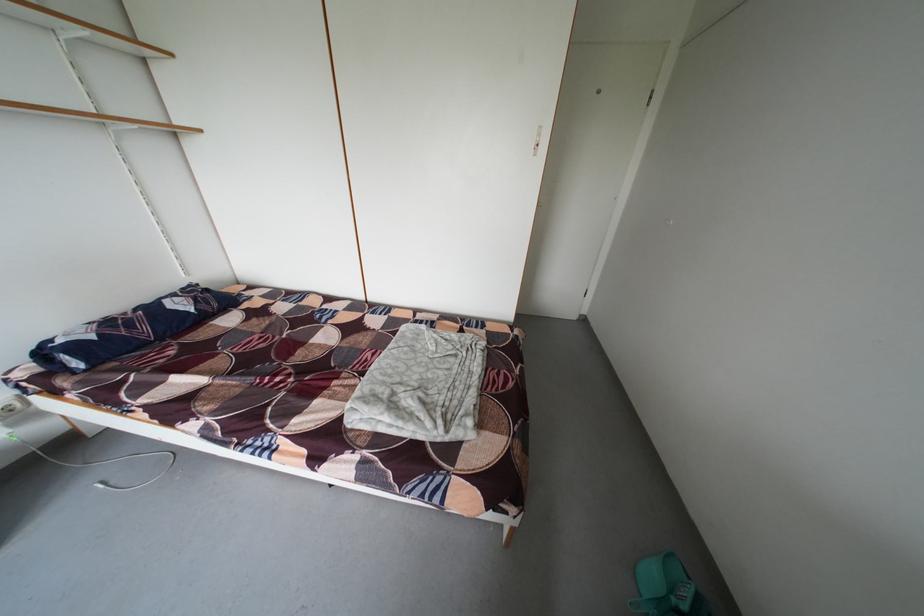
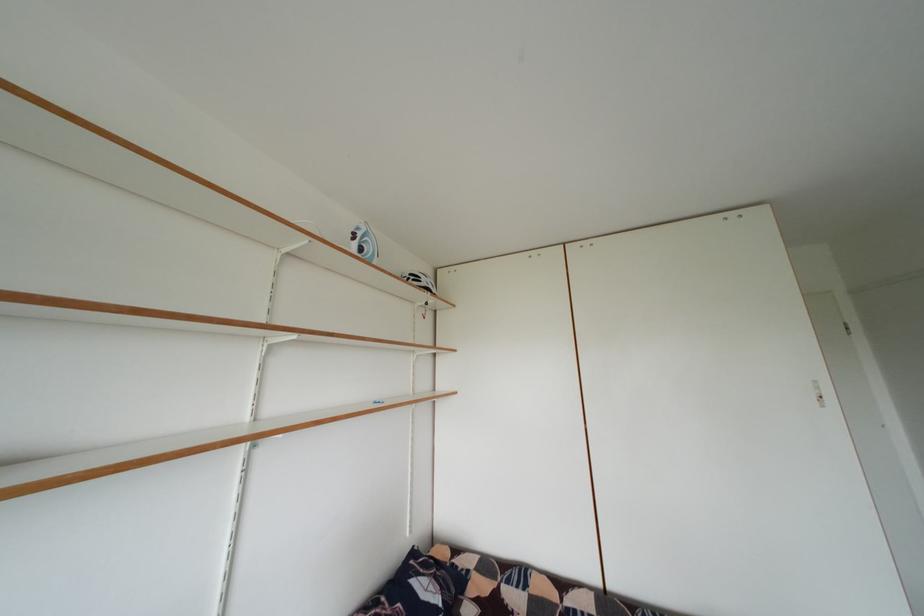
The images are taken continuously from a first-person perspective. In which direction is your viewpoint rotating?

The camera rotated toward left-up.